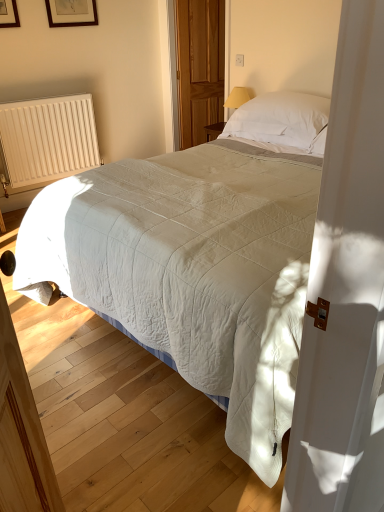
Question: Could you tell me if white ribbed radiator at left is facing white soft pillow at upper center?

Choices:
 (A) no
 (B) yes

Answer: (B)

Question: From a real-world perspective, is white ribbed radiator at left positioned under white soft pillow at upper center based on gravity?

Choices:
 (A) yes
 (B) no

Answer: (A)

Question: From a real-world perspective, does white ribbed radiator at left stand above white soft pillow at upper center?

Choices:
 (A) yes
 (B) no

Answer: (B)

Question: Is white ribbed radiator at left positioned with its back to white soft pillow at upper center?

Choices:
 (A) yes
 (B) no

Answer: (B)

Question: Considering the relative sizes of white ribbed radiator at left and white soft pillow at upper center in the image provided, is white ribbed radiator at left wider than white soft pillow at upper center?

Choices:
 (A) no
 (B) yes

Answer: (A)

Question: Is white soft pillow at upper center a part of white ribbed radiator at left?

Choices:
 (A) no
 (B) yes

Answer: (A)

Question: Does wooden screen door at center appear on the right side of white ribbed radiator at left?

Choices:
 (A) yes
 (B) no

Answer: (A)

Question: Does wooden screen door at center appear on the left side of white ribbed radiator at left?

Choices:
 (A) no
 (B) yes

Answer: (A)

Question: Can you confirm if wooden screen door at center is wider than white ribbed radiator at left?

Choices:
 (A) no
 (B) yes

Answer: (A)

Question: Is wooden screen door at center taller than white ribbed radiator at left?

Choices:
 (A) no
 (B) yes

Answer: (B)

Question: Can you confirm if wooden screen door at center is bigger than white ribbed radiator at left?

Choices:
 (A) yes
 (B) no

Answer: (B)

Question: Could you tell me if wooden screen door at center is turned towards white ribbed radiator at left?

Choices:
 (A) no
 (B) yes

Answer: (A)

Question: Does wooden screen door at center have a lesser height compared to wooden picture frame at upper left?

Choices:
 (A) no
 (B) yes

Answer: (A)